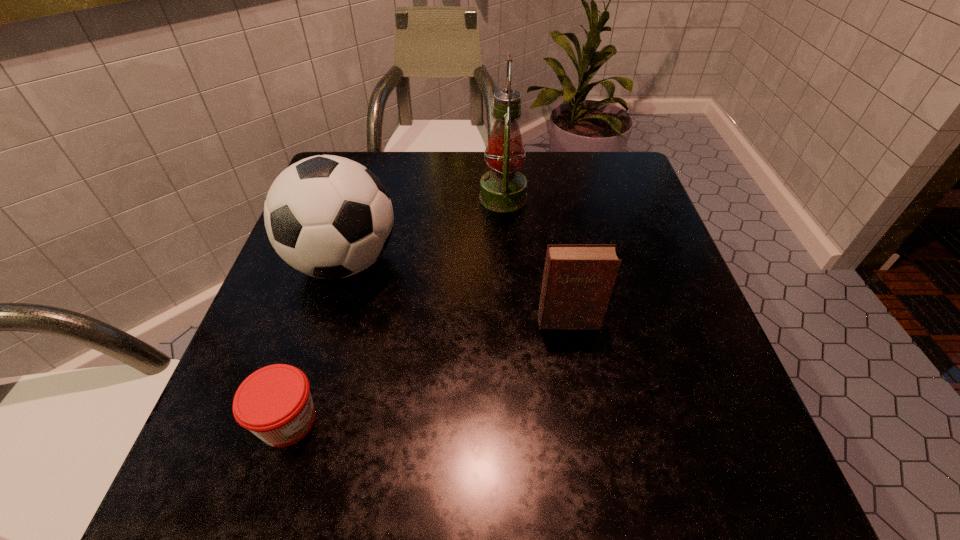
Locate an element on the screen. the farthest object is located at coordinates (503, 189).

Locate an element on the screen. Image resolution: width=960 pixels, height=540 pixels. oil lamp is located at coordinates (503, 189).

You are a GUI agent. You are given a task and a screenshot of the screen. Output one action in this format:
    pyautogui.click(x=<x>, y=<y>)
    Task: Click on the third nearest object
    
    Given the screenshot: What is the action you would take?
    pyautogui.click(x=329, y=217)

Find the location of a particular element. Image resolution: width=960 pixels, height=540 pixels. soccer ball is located at coordinates (329, 217).

Locate an element on the screen. The width and height of the screenshot is (960, 540). the second nearest object is located at coordinates pyautogui.click(x=578, y=280).

I want to click on diary, so click(x=578, y=280).

You are a GUI agent. You are given a task and a screenshot of the screen. Output one action in this format:
    pyautogui.click(x=<x>, y=<y>)
    Task: Click on the shortest object
    The image size is (960, 540).
    Given the screenshot: What is the action you would take?
    pyautogui.click(x=274, y=403)

Find the location of a particular element. Image resolution: width=960 pixels, height=540 pixels. the nearest object is located at coordinates (274, 403).

You are a GUI agent. You are given a task and a screenshot of the screen. Output one action in this format:
    pyautogui.click(x=<x>, y=<y>)
    Task: Click on the free space located on the front of the oil lamp
    
    Given the screenshot: What is the action you would take?
    (505, 234)

Where is `blank space located on the front of the third shortest object`? blank space located on the front of the third shortest object is located at coordinates (272, 498).